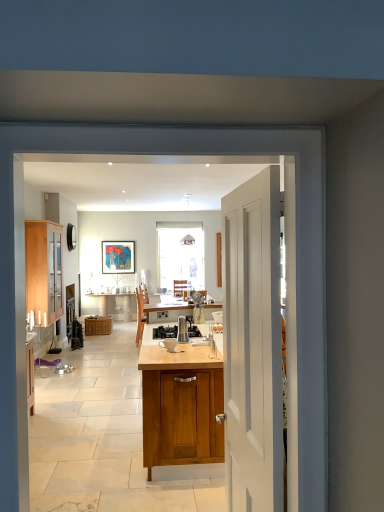
Question: Does point (104, 329) appear closer or farther from the camera than point (178, 330)?

Choices:
 (A) farther
 (B) closer

Answer: (A)

Question: From the image's perspective, relative to satin silver coffee maker at center, is woven brown picnic basket at center above or below?

Choices:
 (A) above
 (B) below

Answer: (B)

Question: Estimate the real-world distances between objects in this image. Which object is closer to the satin silver coffee maker at center?

Choices:
 (A) stainless steel gas stove at center
 (B) woven brown picnic basket at center
 (C) light wood/glass cabinet at left
 (D) white matte door at center
 (E) wooden cabinet at center

Answer: (A)

Question: Estimate the real-world distances between objects in this image. Which object is farther from the stainless steel gas stove at center?

Choices:
 (A) wooden cabinet at center
 (B) woven brown picnic basket at center
 (C) light wood/glass cabinet at left
 (D) metallic pendant light at upper center
 (E) satin silver coffee maker at center

Answer: (B)